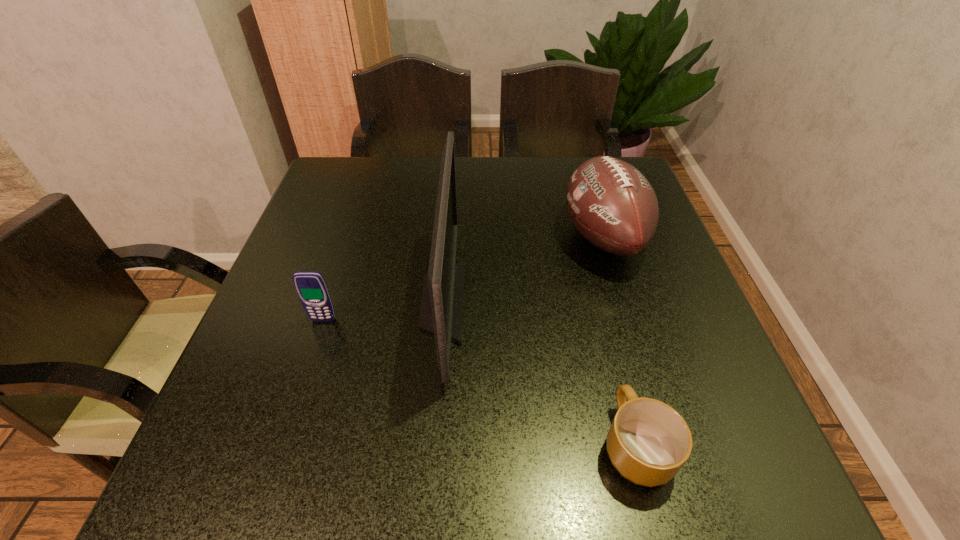
The width and height of the screenshot is (960, 540). Identify the location of vacant area located 0.350m on the side with the handle of the nearest object. (589, 266).

In order to click on vacant region located 0.100m on the side with the handle of the nearest object in this screenshot , I will do `click(612, 356)`.

Locate an element on the screen. free space located on the side with the handle of the nearest object is located at coordinates (607, 331).

Locate an element on the screen. The height and width of the screenshot is (540, 960). object that is at the far edge is located at coordinates (614, 207).

Image resolution: width=960 pixels, height=540 pixels. I want to click on object located in the near edge section of the desktop, so click(x=648, y=442).

What are the coordinates of `object present at the left edge` in the screenshot? It's located at (311, 287).

Find the location of `football (American) located in the right edge section of the desktop`. football (American) located in the right edge section of the desktop is located at coordinates (614, 207).

Identify the location of mug at the right edge. (648, 442).

Find the location of a particular element. This screenshot has height=540, width=960. object present at the far right corner is located at coordinates (614, 207).

The image size is (960, 540). What are the coordinates of `object that is positioned at the near right corner` in the screenshot? It's located at (648, 442).